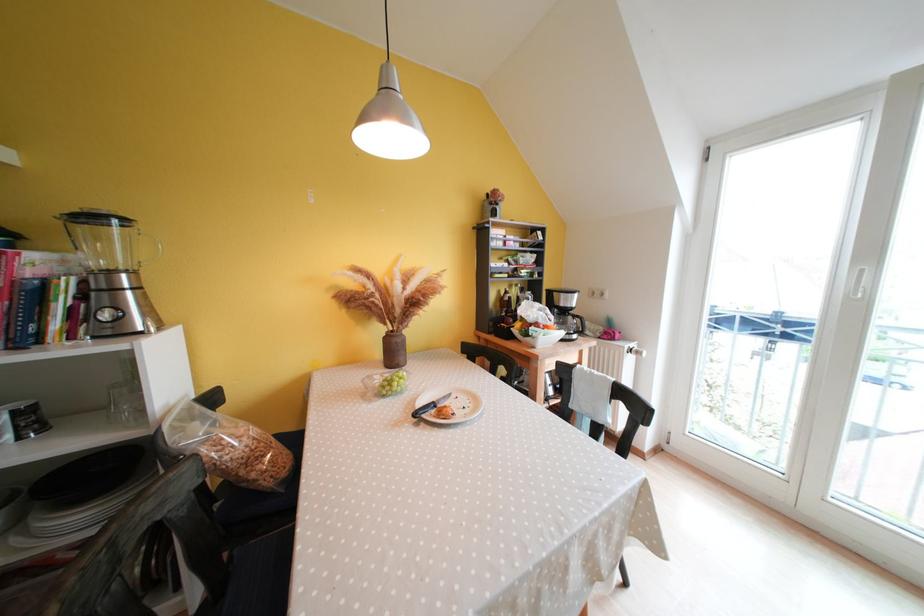
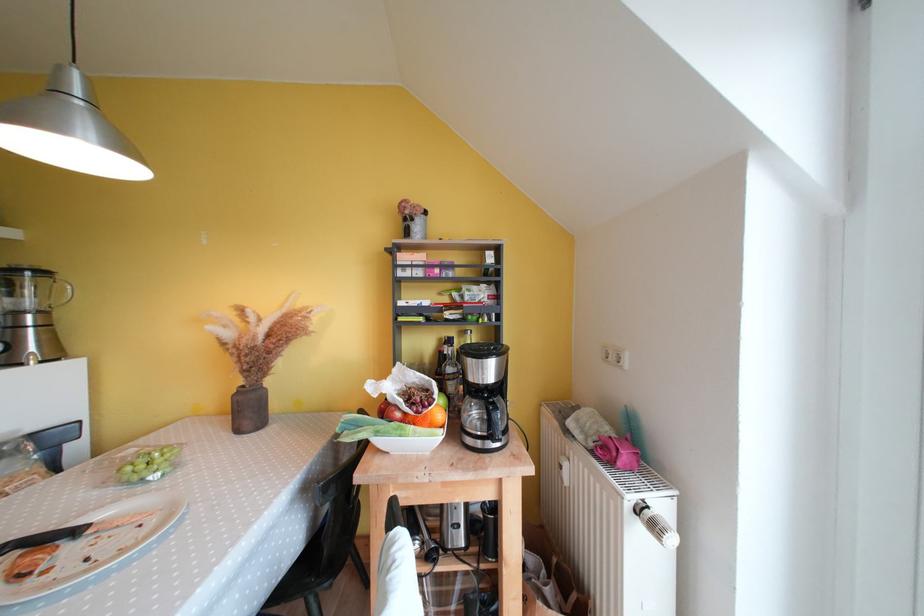
Locate, in the second image, the point that corresponds to pixel 140 276 in the first image.

(49, 315)